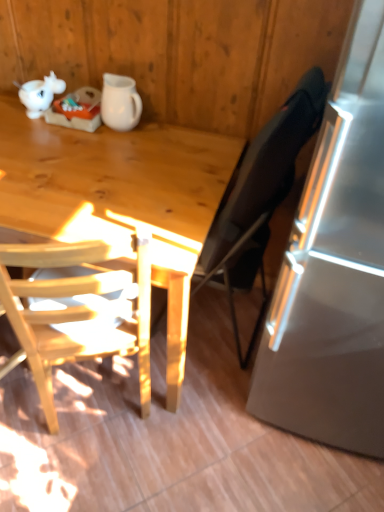
This screenshot has width=384, height=512. What are the coordinates of `vacant space to the left of white matte pitcher at upper center` in the screenshot? It's located at (62, 129).